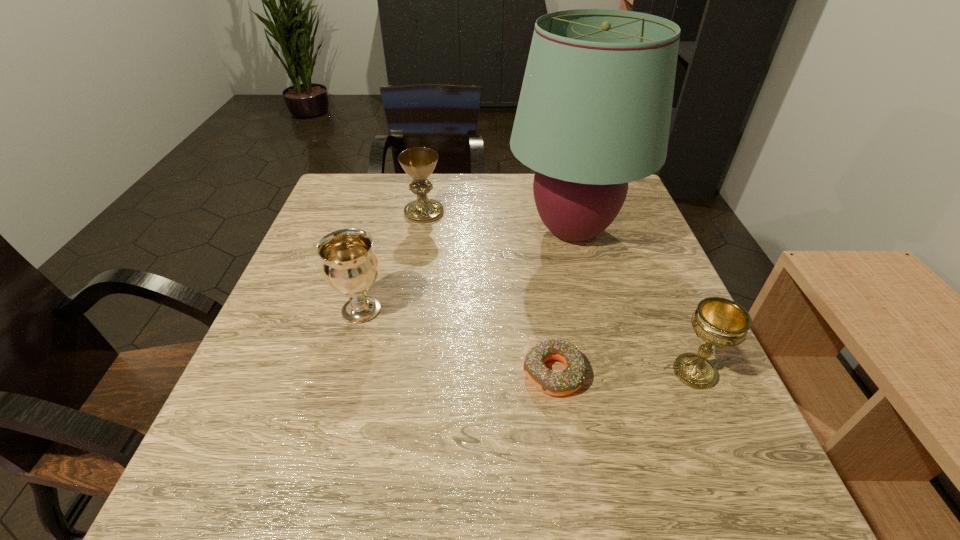
This screenshot has height=540, width=960. Identify the location of empty location between the farthest chalice and the doughnut. (489, 293).

The image size is (960, 540). Identify the location of object that can be found as the fourth closest to the farthest chalice. click(720, 322).

This screenshot has height=540, width=960. I want to click on object that is the fourth closest to the second farthest chalice, so click(720, 322).

Identify which chalice is located as the nearest to the second farthest chalice. Please provide its 2D coordinates. Your answer should be formatted as a tuple, i.e. [(x, y)], where the tuple contains the x and y coordinates of a point satisfying the conditions above.

[(419, 162)]

This screenshot has height=540, width=960. I want to click on chalice identified as the second closest to the farthest chalice, so click(720, 322).

The image size is (960, 540). What are the coordinates of `vacant space that satisfies the following two spatial constraints: 1. on the front side of the nearest chalice; 2. on the right side of the second nearest chalice` in the screenshot? It's located at (344, 372).

In order to click on vacant position in the image that satisfies the following two spatial constraints: 1. on the front side of the doughnut; 2. on the left side of the second farthest chalice in this screenshot , I will do `click(344, 373)`.

At what (x,y) coordinates should I click in order to perform the action: click on vacant point that satisfies the following two spatial constraints: 1. on the front side of the farthest chalice; 2. on the left side of the lampshade. Please return your answer as a coordinate pair (x, y). Looking at the image, I should click on (420, 231).

Locate an element on the screen. Image resolution: width=960 pixels, height=540 pixels. vacant space that satisfies the following two spatial constraints: 1. on the back side of the second nearest chalice; 2. on the right side of the lampshade is located at coordinates (383, 231).